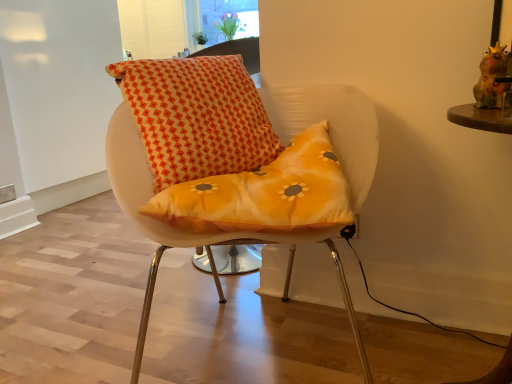
Question: Should I look upward or downward to see matte orange cushion at center?

Choices:
 (A) up
 (B) down

Answer: (B)

Question: From a real-world perspective, is matte orange cushion at center beneath brown wooden table at right?

Choices:
 (A) no
 (B) yes

Answer: (A)

Question: Is matte orange cushion at center outside brown wooden table at right?

Choices:
 (A) yes
 (B) no

Answer: (A)

Question: From the image's perspective, is matte orange cushion at center on brown wooden table at right?

Choices:
 (A) no
 (B) yes

Answer: (B)

Question: Considering the relative sizes of matte orange cushion at center and brown wooden table at right in the image provided, is matte orange cushion at center smaller than brown wooden table at right?

Choices:
 (A) no
 (B) yes

Answer: (A)

Question: Does matte orange cushion at center appear on the right side of brown wooden table at right?

Choices:
 (A) yes
 (B) no

Answer: (B)

Question: Is brown wooden table at right a part of matte orange cushion at center?

Choices:
 (A) no
 (B) yes

Answer: (A)

Question: Is transparent glass window at upper center closer to camera compared to orange printed cushion at upper center?

Choices:
 (A) no
 (B) yes

Answer: (A)

Question: Is transparent glass window at upper center in contact with orange printed cushion at upper center?

Choices:
 (A) no
 (B) yes

Answer: (A)

Question: Is transparent glass window at upper center wider than orange printed cushion at upper center?

Choices:
 (A) no
 (B) yes

Answer: (A)

Question: From the image's perspective, is transparent glass window at upper center over orange printed cushion at upper center?

Choices:
 (A) yes
 (B) no

Answer: (A)

Question: Could you tell me if transparent glass window at upper center is facing orange printed cushion at upper center?

Choices:
 (A) no
 (B) yes

Answer: (B)

Question: Is transparent glass window at upper center far from orange printed cushion at upper center?

Choices:
 (A) yes
 (B) no

Answer: (A)

Question: Could you tell me if orange printed cushion at upper center is facing brown wooden table at right?

Choices:
 (A) yes
 (B) no

Answer: (B)